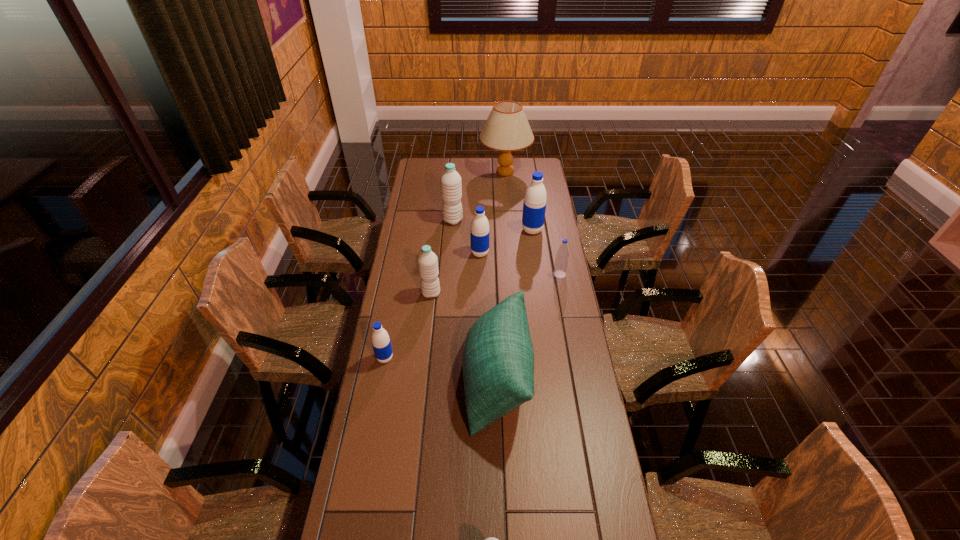
The height and width of the screenshot is (540, 960). Identify the location of lampshade. (507, 129).

I want to click on the tallest object, so click(x=507, y=129).

Find the location of a particular element. the biggest white water bottle is located at coordinates tap(451, 185).

The height and width of the screenshot is (540, 960). I want to click on the biggest blue water bottle, so click(x=534, y=206).

Where is `the second blue water bottle from right to left`? Image resolution: width=960 pixels, height=540 pixels. the second blue water bottle from right to left is located at coordinates pos(534,206).

At what (x,y) coordinates should I click in order to perform the action: click on the sixth farthest object. Please return your answer as a coordinate pair (x, y). The image size is (960, 540). Looking at the image, I should click on (427, 260).

Find the location of a particular element. the second smallest white water bottle is located at coordinates (427, 260).

Identify the location of the second farthest blue water bottle. The width and height of the screenshot is (960, 540). [x=479, y=234].

Find the location of `the sixth nearest object`. the sixth nearest object is located at coordinates (479, 234).

This screenshot has width=960, height=540. Identify the location of cushion. (498, 360).